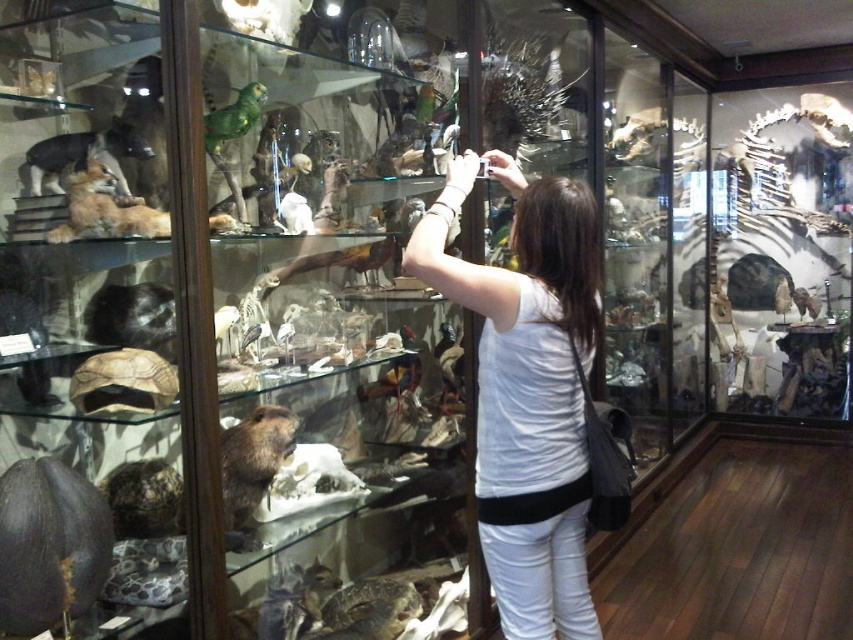
Question: Among these points, which one is nearest to the camera?

Choices:
 (A) (33, 148)
 (B) (241, 488)
 (C) (584, 438)
 (D) (91, 410)

Answer: (D)

Question: Which of the following is the closest to the observer?

Choices:
 (A) white cotton shirt at center
 (B) brown furry beaver at lower left

Answer: (A)

Question: Observing the image, what is the correct spatial positioning of brown furry beaver at lower left in reference to brown textured tortoise at lower left?

Choices:
 (A) left
 (B) right

Answer: (B)

Question: Observing the image, what is the correct spatial positioning of white cotton shirt at center in reference to brown textured tortoise at lower left?

Choices:
 (A) left
 (B) right

Answer: (B)

Question: Does brown furry beaver at lower left appear over brown fur dog at left?

Choices:
 (A) yes
 (B) no

Answer: (B)

Question: Which point is farther to the camera?

Choices:
 (A) brown fur dog at left
 (B) brown furry beaver at lower left
 (C) brown textured tortoise at lower left
 (D) white cotton shirt at center

Answer: (A)